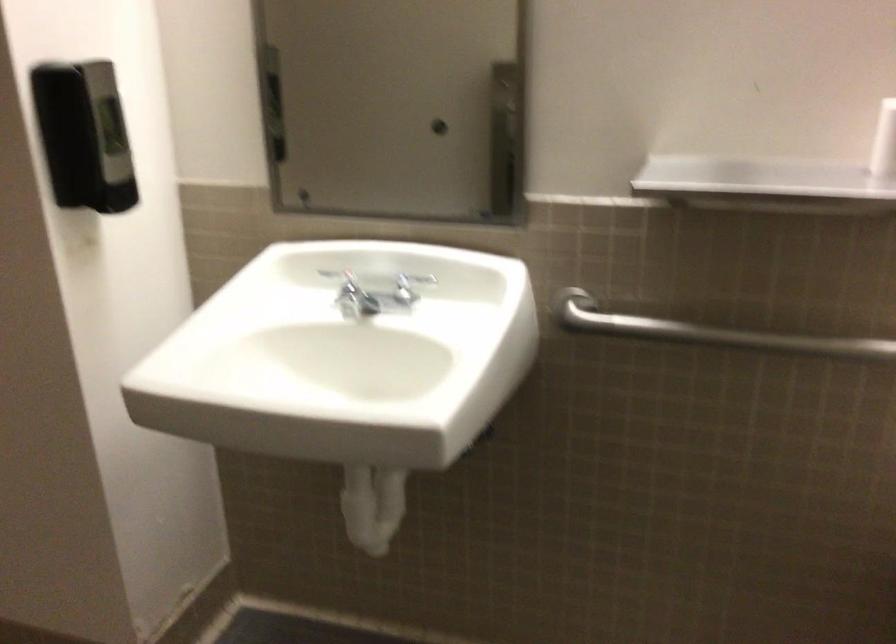
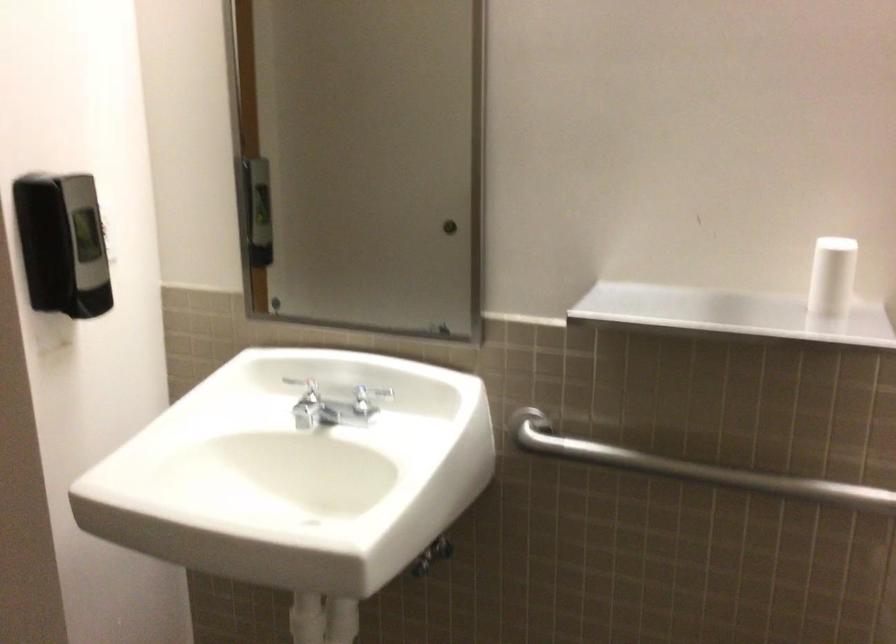
Find the pixel in the second image that matches [341,278] in the first image.

(305, 389)